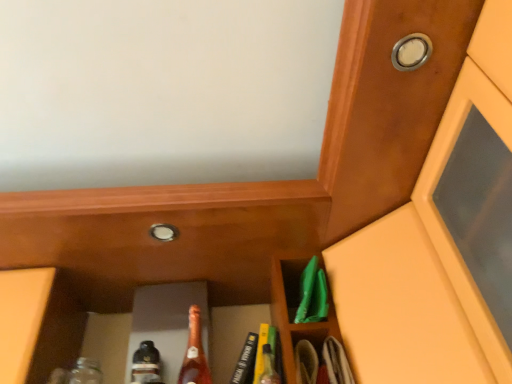
This screenshot has width=512, height=384. I want to click on vacant area on top of matte brown cabinet at center (from a real-world perspective), so click(200, 281).